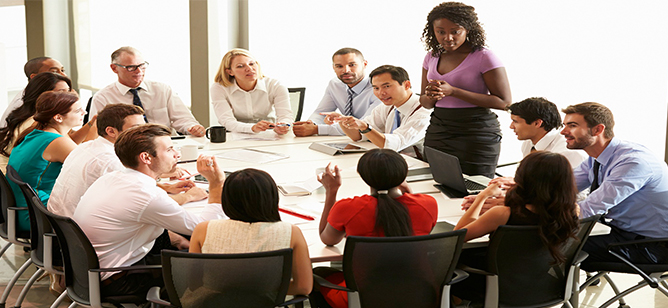
Identify the location of chairs. The height and width of the screenshot is (308, 668). (7, 206), (39, 217), (63, 240), (202, 276), (377, 267), (514, 253), (614, 247), (298, 97).